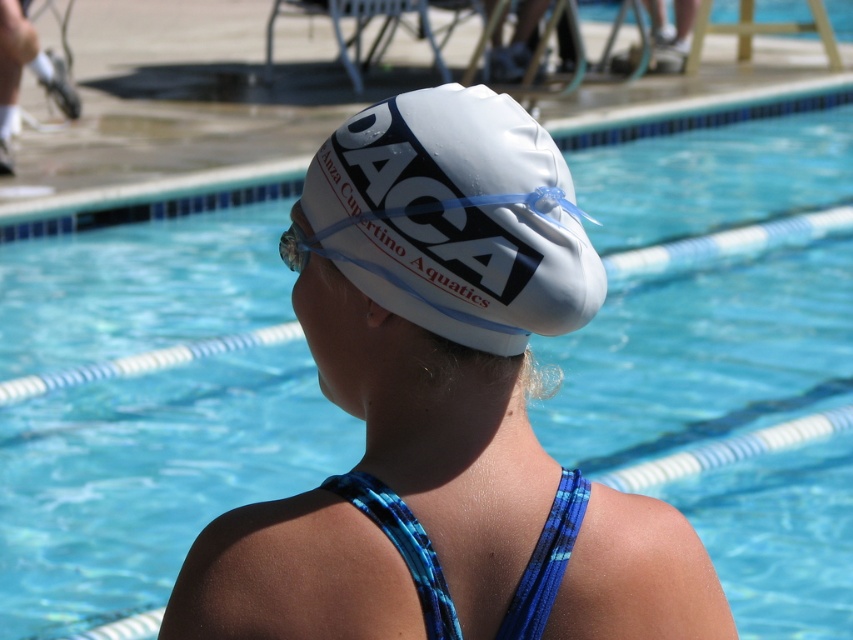
Looking at this image, you are a swimmer preparing to adjust your equipment. You have the blue woven strap at back and the clear plastic goggles at center in your view. Which of these two items is wider?

The blue woven strap at back is wider than the clear plastic goggles at center.

You are a lifeguard observing the pool from the edge. There is a point marked at coordinates (456, 218). What object is located at that point?

The point at coordinates (456, 218) indicates the white matte swim cap at center.

You are a swimmer in the pool and want to move from point (531, 330) to point (421, 548). Which direction should you swim to reach your destination?

You should swim forward because point (531, 330) is behind point (421, 548), so moving towards it would require swimming in the forward direction.